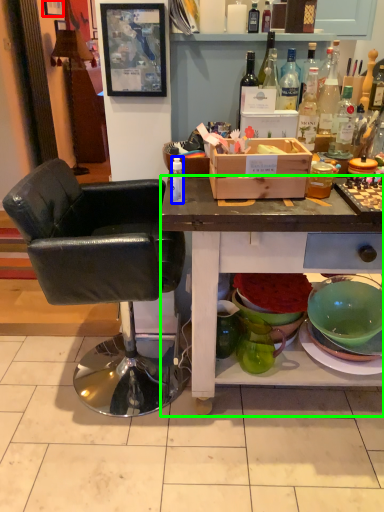
Question: Which object is the closest to the picture frame (highlighted by a red box)? Choose among these: bottle (highlighted by a blue box) or desk (highlighted by a green box).

Choices:
 (A) bottle
 (B) desk

Answer: (A)